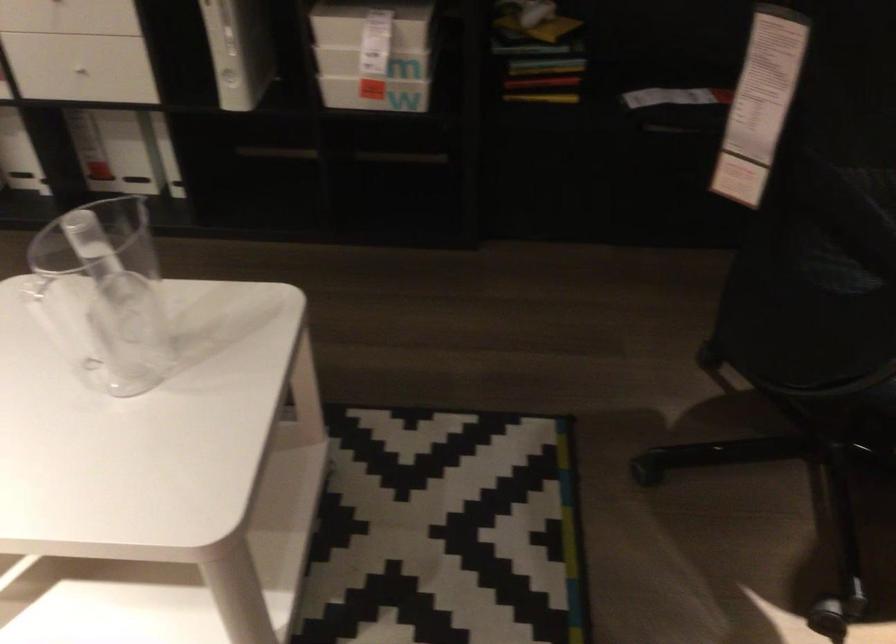
You are a GUI agent. You are given a task and a screenshot of the screen. Output one action in this format:
    pyautogui.click(x=<x>, y=<y>)
    Task: Click on the clear plastic scoop
    This screenshot has width=896, height=644.
    Given the screenshot: What is the action you would take?
    pyautogui.click(x=117, y=304)